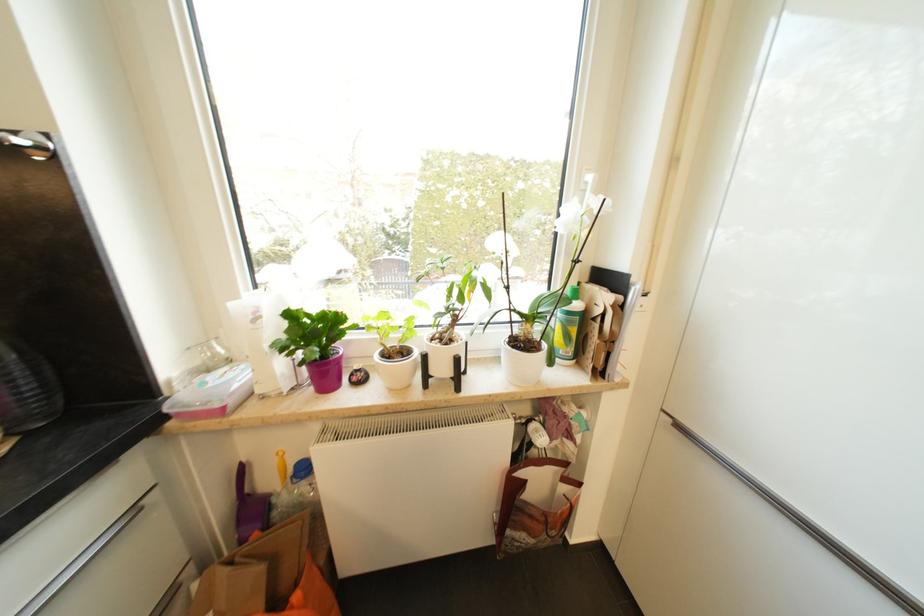
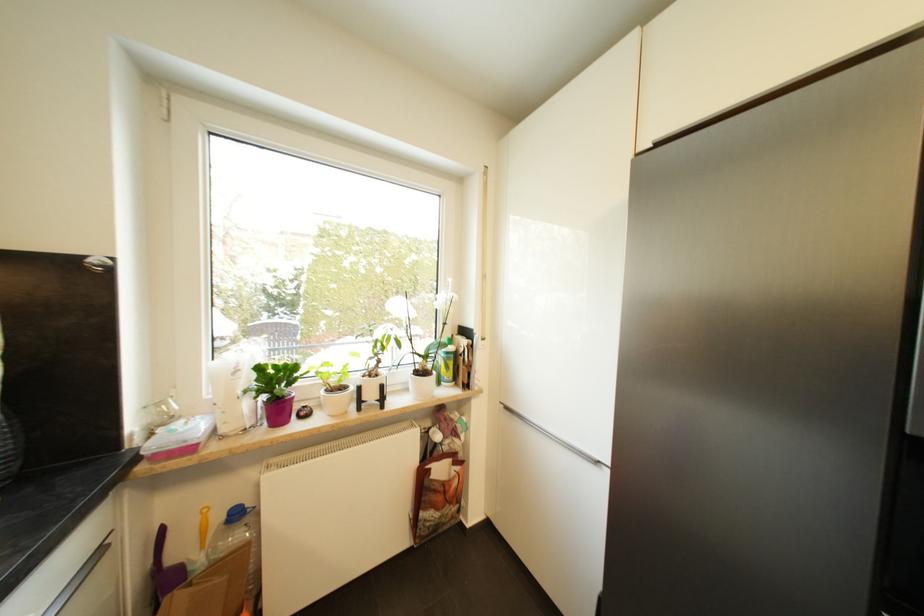
Find the pixel in the second image that matches [685,429] in the first image.

(512, 410)